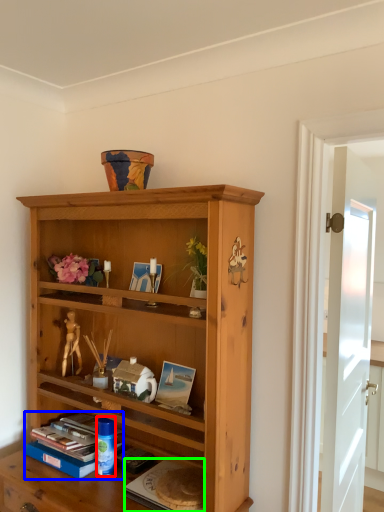
Question: Which is nearer to the toy (highlighted by a red box)? book (highlighted by a blue box) or paperback book (highlighted by a green box).

Choices:
 (A) book
 (B) paperback book

Answer: (A)